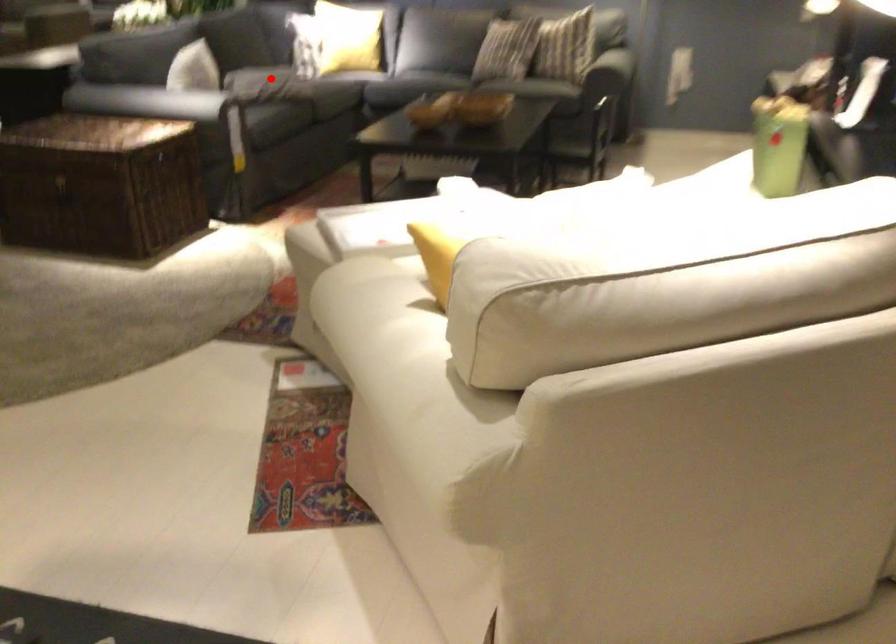
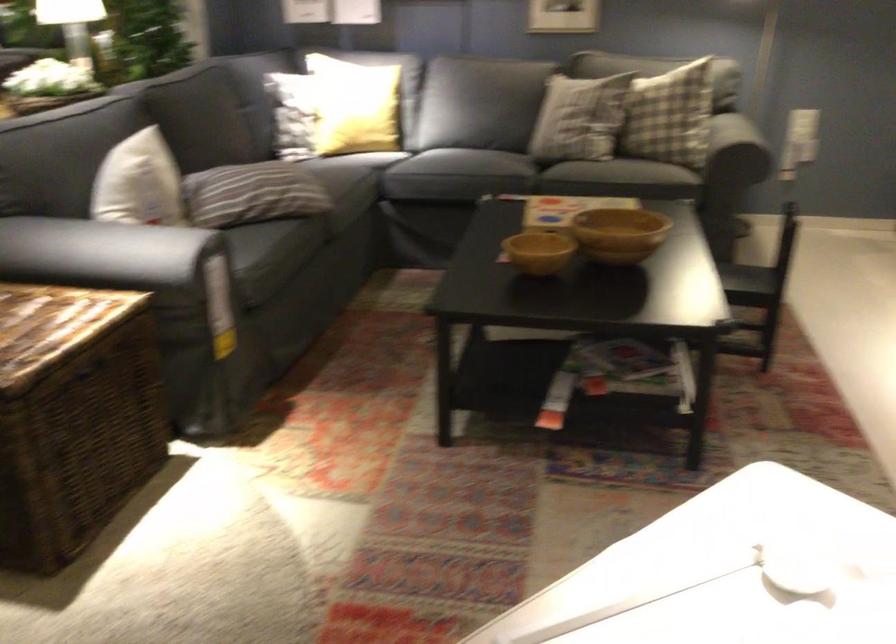
Question: I am providing you with two images of the same scene from different viewpoints. Image1 has a red point marked. In image2, the corresponding 3D location appears at what relative position? Reply with the corresponding letter.

Choices:
 (A) Closer
 (B) Farther

Answer: (A)